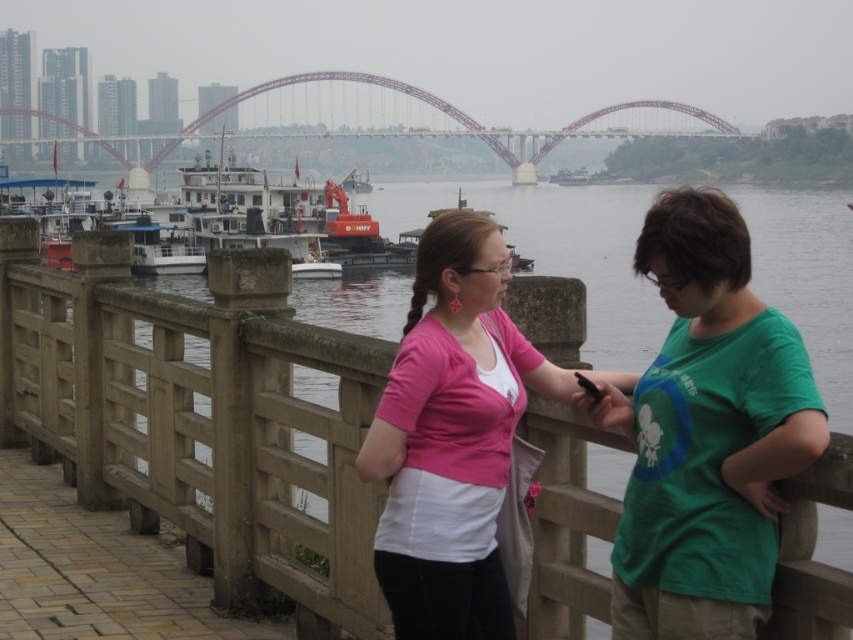
Between pink fabric shirt at center and metallic bridge at upper center, which one appears on the left side from the viewer's perspective?

metallic bridge at upper center is more to the left.

Looking at this image, is pink fabric shirt at center to the left of metallic bridge at upper center from the viewer's perspective?

In fact, pink fabric shirt at center is to the right of metallic bridge at upper center.

Is point (486, 326) farther from camera compared to point (268, 84)?

That is False.

Locate an element on the screen. This screenshot has height=640, width=853. pink fabric shirt at center is located at coordinates (451, 436).

Can you confirm if brown wooden rail at center is bigger than pink fabric shirt at center?

Yes, brown wooden rail at center is bigger than pink fabric shirt at center.

Is point (334, 371) less distant than point (432, 516)?

No, it is behind (432, 516).

Locate an element on the screen. brown wooden rail at center is located at coordinates click(198, 417).

Between brown wooden rail at center and metallic bridge at upper center, which one has more height?

Standing taller between the two is metallic bridge at upper center.

Which is more to the right, brown wooden rail at center or metallic bridge at upper center?

From the viewer's perspective, brown wooden rail at center appears more on the right side.

Who is more forward, [360,557] or [614,106]?

Point [360,557] is in front.

The width and height of the screenshot is (853, 640). Identify the location of brown wooden rail at center. (198, 417).